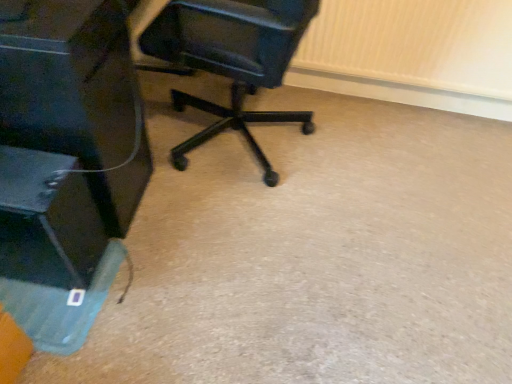
This screenshot has height=384, width=512. Describe the element at coordinates (232, 59) in the screenshot. I see `black plastic chair at center` at that location.

Measure the distance between black plastic chair at center and camera.

1.13 meters.

Find the location of a particular element. The height and width of the screenshot is (384, 512). black plastic chair at center is located at coordinates (232, 59).

Image resolution: width=512 pixels, height=384 pixels. Identify the location of matte black monitor at left. (77, 97).

What do you see at coordinates (77, 97) in the screenshot? The height and width of the screenshot is (384, 512). I see `matte black monitor at left` at bounding box center [77, 97].

I want to click on black plastic chair at center, so click(232, 59).

Which object is positioned more to the left, black plastic chair at center or matte black monitor at left?

matte black monitor at left is more to the left.

Considering their positions, is black plastic chair at center located in front of or behind matte black monitor at left?

Clearly, black plastic chair at center is behind matte black monitor at left.

Which is in front, point (291, 51) or point (110, 113)?

The point (291, 51) is closer to the camera.

From the image's perspective, which one is positioned higher, black plastic chair at center or matte black monitor at left?

From the image's view, black plastic chair at center is above.

Looking at this image, from a real-world perspective, is black plastic chair at center over matte black monitor at left?

Yes, from a real-world perspective, black plastic chair at center is over matte black monitor at left

Which of these two, black plastic chair at center or matte black monitor at left, is thinner?

matte black monitor at left.

Between black plastic chair at center and matte black monitor at left, which one has more height?

black plastic chair at center is taller.

Can you confirm if black plastic chair at center is bigger than matte black monitor at left?

Actually, black plastic chair at center might be smaller than matte black monitor at left.

Does black plastic chair at center contain matte black monitor at left?

That's incorrect, matte black monitor at left is not inside black plastic chair at center.

Is black plastic chair at center not near matte black monitor at left?

black plastic chair at center is actually quite close to matte black monitor at left.

Is black plastic chair at center facing away from matte black monitor at left?

No, black plastic chair at center is not facing the opposite direction of matte black monitor at left.

What's the angular difference between black plastic chair at center and matte black monitor at left's facing directions?

The facing directions of black plastic chair at center and matte black monitor at left are 172 degrees apart.

At what (x,y) coordinates should I click in order to perform the action: click on furniture located in front of the black plastic chair at center. Please return your answer as a coordinate pair (x, y). This screenshot has height=384, width=512. Looking at the image, I should click on (77, 97).

Considering the relative positions of matte black monitor at left and black plastic chair at center in the image provided, is matte black monitor at left to the left or to the right of black plastic chair at center?

In the image, matte black monitor at left appears on the left side of black plastic chair at center.

Which is in front, matte black monitor at left or black plastic chair at center?

matte black monitor at left is in front.

Between point (35, 101) and point (267, 14), which one is positioned behind?

The point (267, 14) is farther.

From the image's perspective, is matte black monitor at left positioned above or below black plastic chair at center?

Clearly, from the image's perspective, matte black monitor at left is below black plastic chair at center.

From a real-world perspective, relative to black plastic chair at center, is matte black monitor at left vertically above or below?

matte black monitor at left is below black plastic chair at center.

Considering the sizes of objects matte black monitor at left and black plastic chair at center in the image provided, who is wider, matte black monitor at left or black plastic chair at center?

black plastic chair at center is wider.

Can you confirm if matte black monitor at left is taller than black plastic chair at center?

Incorrect, the height of matte black monitor at left is not larger of that of black plastic chair at center.

Can you confirm if matte black monitor at left is smaller than black plastic chair at center?

No, matte black monitor at left is not smaller than black plastic chair at center.

Is black plastic chair at center located within matte black monitor at left?

Actually, black plastic chair at center is outside matte black monitor at left.

Is matte black monitor at left not near black plastic chair at center?

No, matte black monitor at left is not far away from black plastic chair at center.

Could you tell me if matte black monitor at left is facing black plastic chair at center?

Yes, matte black monitor at left is oriented towards black plastic chair at center.

How different are the orientations of matte black monitor at left and black plastic chair at center in degrees?

The angular difference between matte black monitor at left and black plastic chair at center is 172 degrees.

Where is `chair above the matte black monitor at left (from the image's perspective)`? chair above the matte black monitor at left (from the image's perspective) is located at coordinates (232, 59).

You are a GUI agent. You are given a task and a screenshot of the screen. Output one action in this format:
    pyautogui.click(x=<x>, y=<y>)
    Task: Click on the chair to the right of matte black monitor at left
    The height and width of the screenshot is (384, 512).
    Given the screenshot: What is the action you would take?
    [232, 59]

The width and height of the screenshot is (512, 384). I want to click on furniture that is on the left side of black plastic chair at center, so click(x=77, y=97).